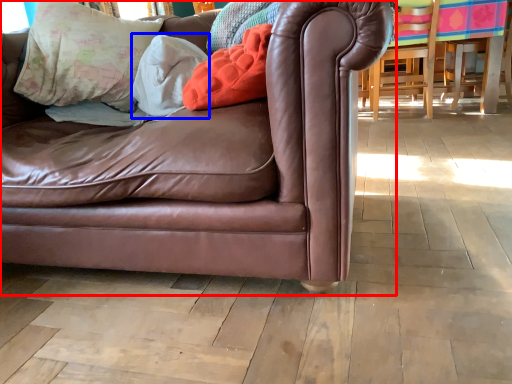
Question: Which point is further to the camera, studio couch (highlighted by a red box) or pillow (highlighted by a blue box)?

Choices:
 (A) studio couch
 (B) pillow

Answer: (B)